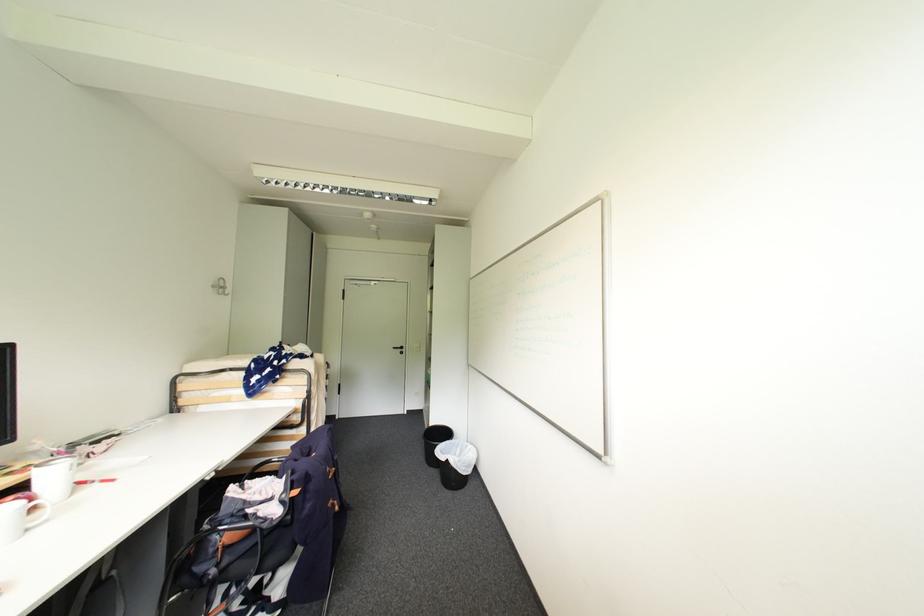
Identify the location of metal wall hook. (220, 286).